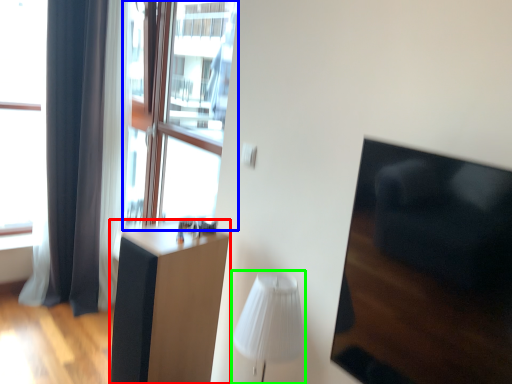
Question: Estimate the real-world distances between objects in this image. Which object is farther from furniture (highlighted by a red box), window screen (highlighted by a blue box) or table lamp (highlighted by a green box)?

Choices:
 (A) window screen
 (B) table lamp

Answer: (A)